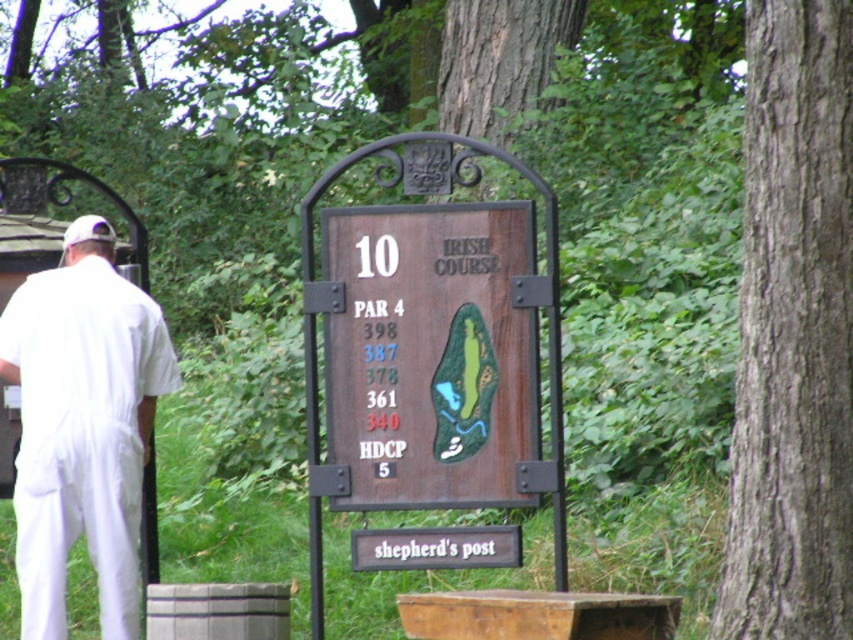
What is the 2D coordinate of the brown rough bark tree at right?

The 2D coordinate of the brown rough bark tree at right is at point (x=793, y=333).